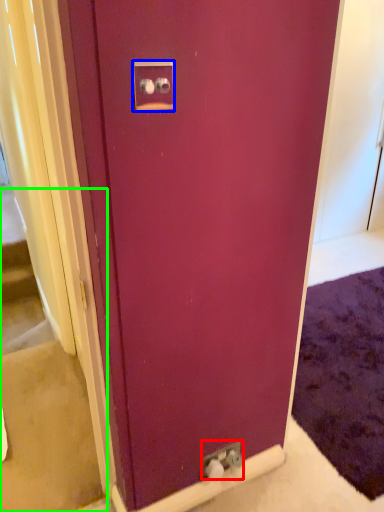
Question: Which object is positioned farthest from electric outlet (highlighted by a red box)? Select from electric outlet (highlighted by a blue box) and stairwell (highlighted by a green box).

Choices:
 (A) electric outlet
 (B) stairwell

Answer: (A)